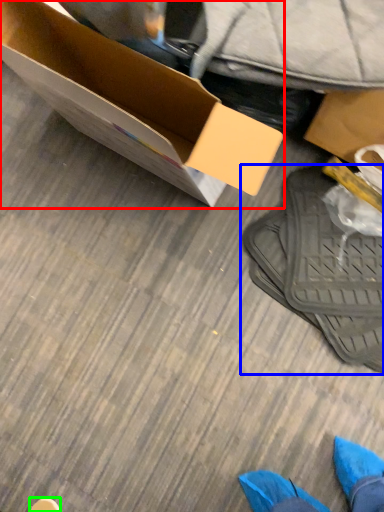
Question: Estimate the real-world distances between objects in this image. Which object is farther from box (highlighted by a red box), footwear (highlighted by a blue box) or shoe (highlighted by a green box)?

Choices:
 (A) footwear
 (B) shoe

Answer: (B)